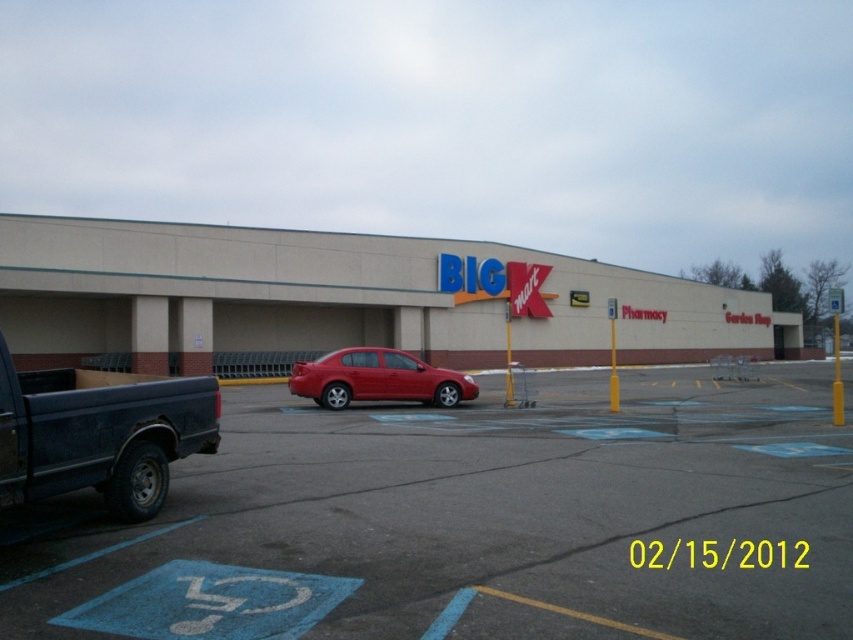
Question: Can you confirm if smooth asphalt parking lot at center is positioned to the right of matte red sedan at center?

Choices:
 (A) yes
 (B) no

Answer: (A)

Question: Which object is farther from the camera taking this photo?

Choices:
 (A) matte red sedan at center
 (B) beige concrete building at center
 (C) smooth asphalt parking lot at center
 (D) matte black truck at left

Answer: (B)

Question: Which of the following is the farthest from the observer?

Choices:
 (A) (677, 326)
 (B) (374, 372)
 (C) (720, 448)
 (D) (3, 417)

Answer: (A)

Question: Which point is farther from the camera taking this photo?

Choices:
 (A) (97, 452)
 (B) (436, 285)
 (C) (144, 593)
 (D) (387, 392)

Answer: (B)

Question: Can you confirm if matte black truck at left is positioned to the left of matte red sedan at center?

Choices:
 (A) no
 (B) yes

Answer: (B)

Question: Observing the image, what is the correct spatial positioning of beige concrete building at center in reference to matte black truck at left?

Choices:
 (A) right
 (B) left

Answer: (A)